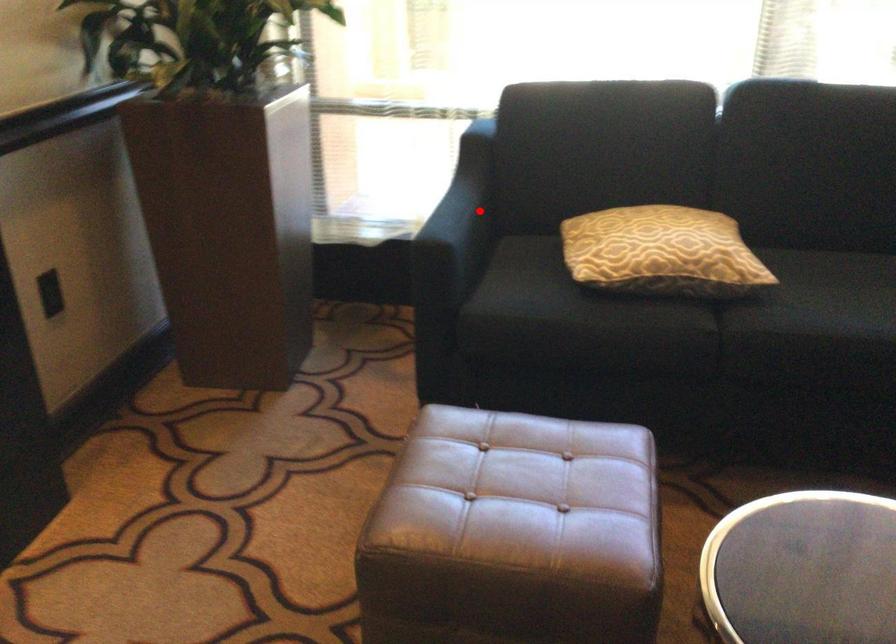
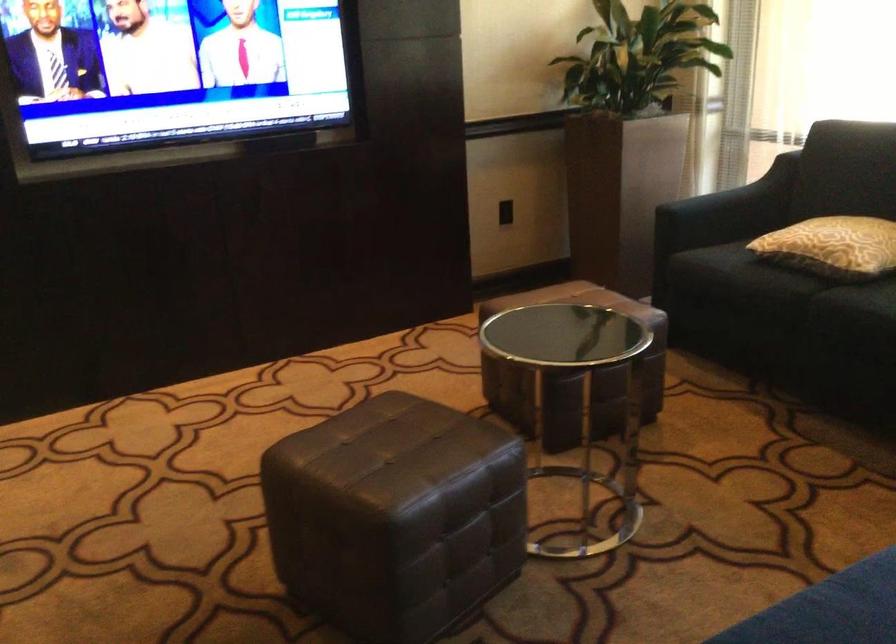
The point at the highlighted location is marked in the first image. Where is the corresponding point in the second image?

(742, 196)